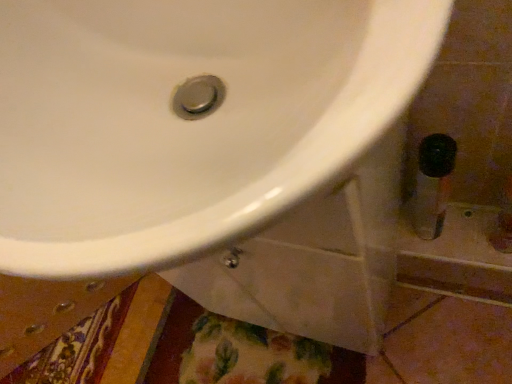
The image size is (512, 384). What do you see at coordinates (187, 120) in the screenshot? I see `white glossy sink at center` at bounding box center [187, 120].

Find the location of a particular element. white glossy sink at center is located at coordinates (187, 120).

What are the coordinates of `white glossy sink at center` in the screenshot? It's located at (187, 120).